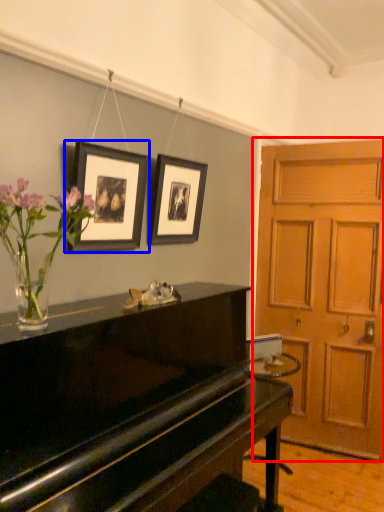
Question: Which point is closer to the camera, door (highlighted by a red box) or picture frame (highlighted by a blue box)?

Choices:
 (A) door
 (B) picture frame

Answer: (B)